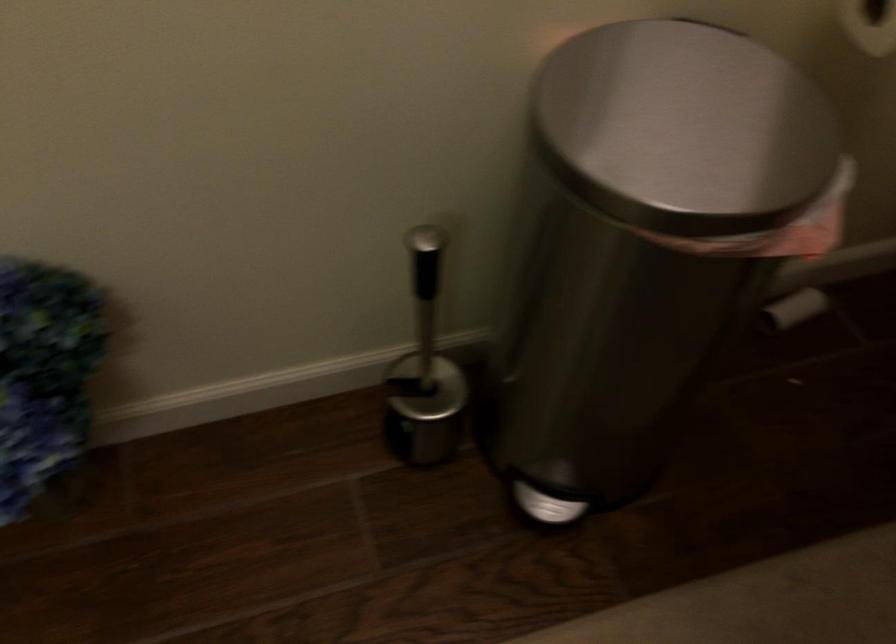
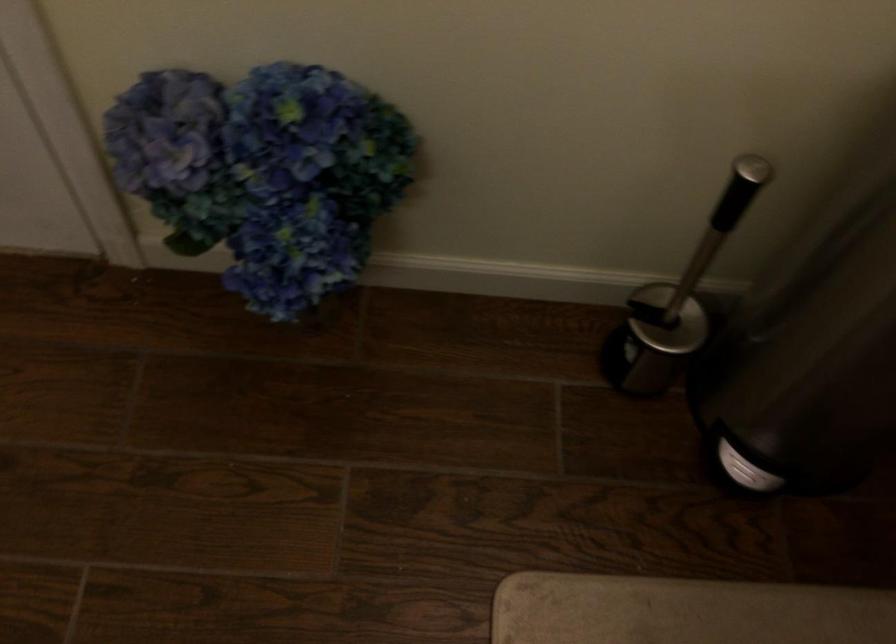
Question: The camera is either moving clockwise (left) or counter-clockwise (right) around the object. The first image is from the beginning of the video and the second image is from the end. Is the camera moving left or right when shooting the video?

Choices:
 (A) Left
 (B) Right

Answer: (B)